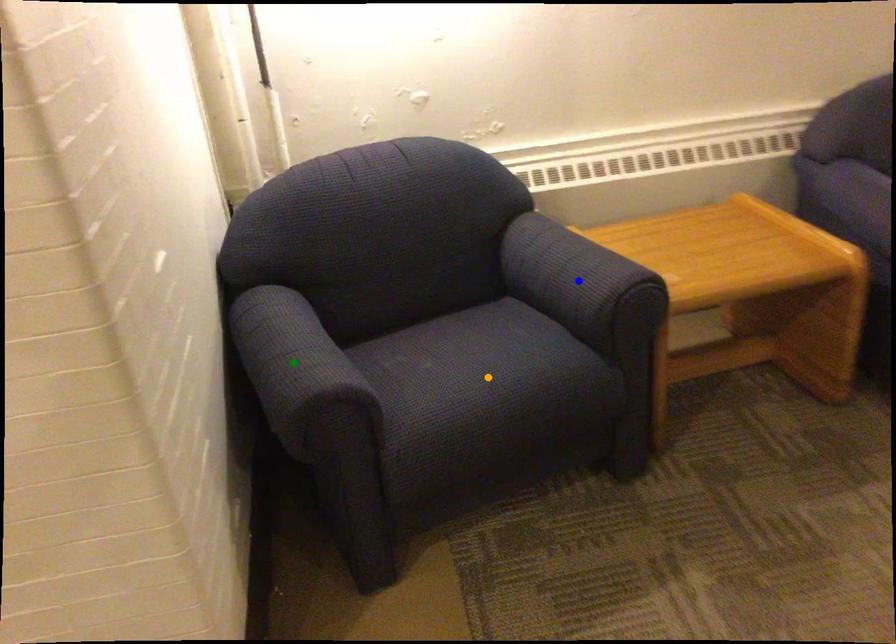
Order these from nearest to farthest:
orange point, blue point, green point

green point < orange point < blue point